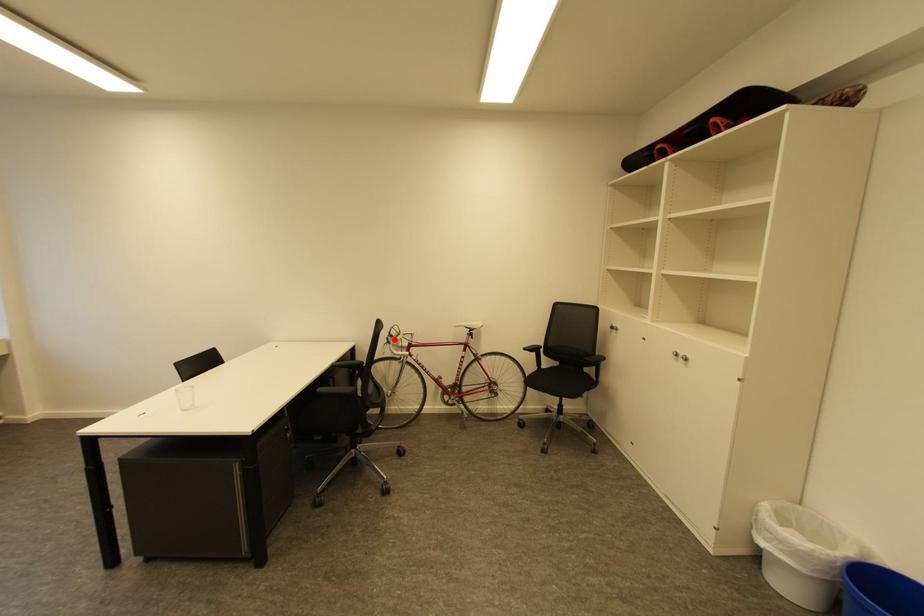
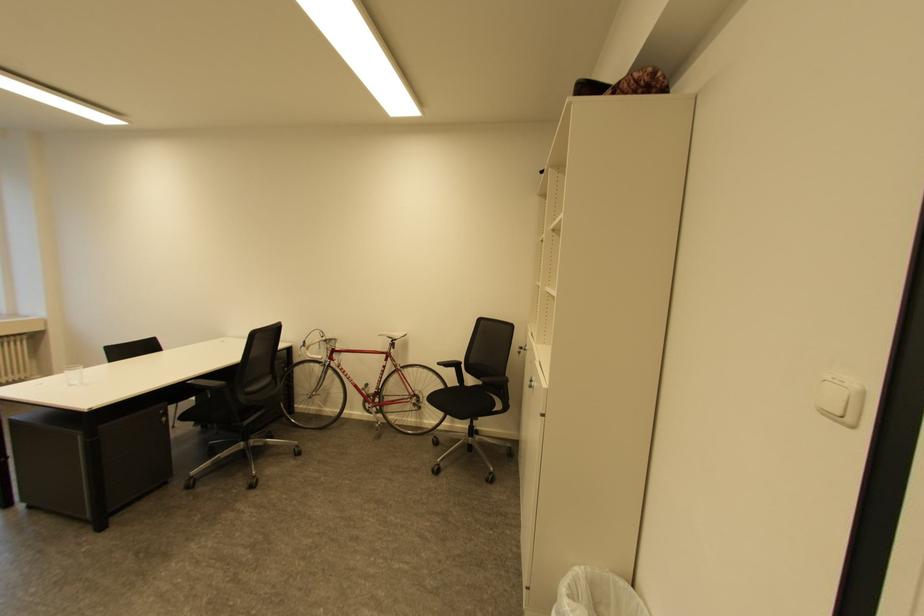
The point at the highlighted location is marked in the first image. Where is the corresponding point in the second image?

(311, 342)